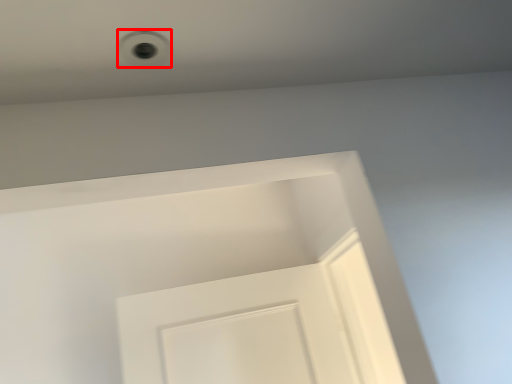
Question: Observing the image, what is the correct spatial positioning of hole (annotated by the red box) in reference to screen door?

Choices:
 (A) right
 (B) left

Answer: (A)